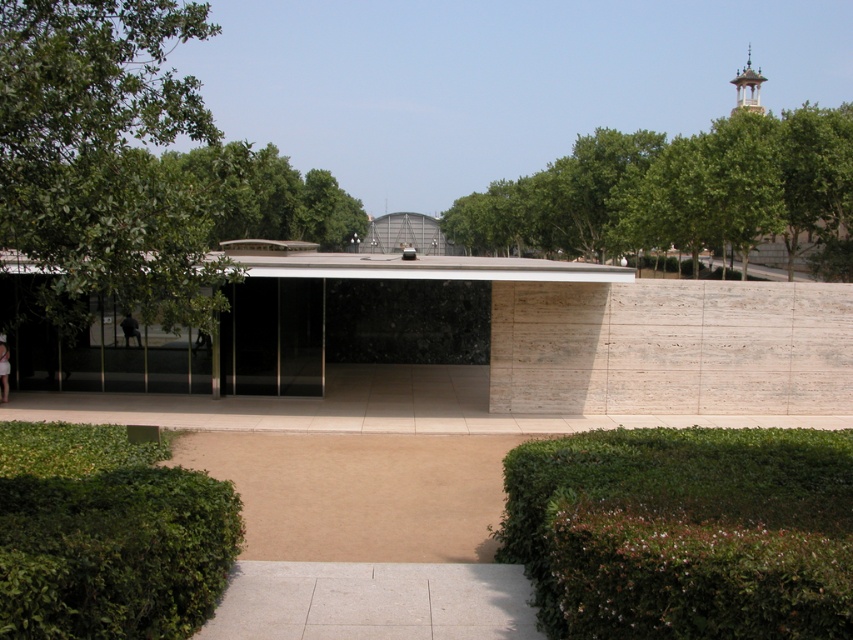
Is green leafy tree at upper center thinner than skinny jeans at center?

No, green leafy tree at upper center is not thinner than skinny jeans at center.

Between green leafy tree at upper center and skinny jeans at center, which one is positioned lower?

skinny jeans at center is lower down.

Who is more distant from viewer, (x=259, y=214) or (x=3, y=337)?

The point (x=259, y=214) is more distant.

The width and height of the screenshot is (853, 640). Identify the location of green leafy tree at upper center. (270, 196).

Who is more forward, (809, 109) or (1, 380)?

Point (1, 380) is in front.

Image resolution: width=853 pixels, height=640 pixels. Describe the element at coordinates (677, 192) in the screenshot. I see `green leafy tree at upper right` at that location.

Does point (846, 177) come behind point (9, 368)?

Yes, it is.

Image resolution: width=853 pixels, height=640 pixels. I want to click on green leafy tree at upper right, so click(x=677, y=192).

How distant is green leafy hedge at lower left from black glass door at center?

18.19 feet

Which is in front, point (212, 592) or point (245, 289)?

Point (212, 592)

Find the location of a particular element. The width and height of the screenshot is (853, 640). green leafy hedge at lower left is located at coordinates (106, 536).